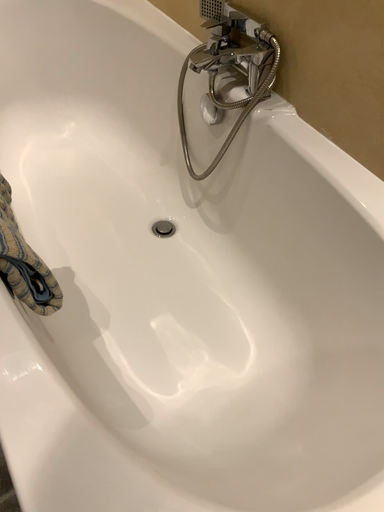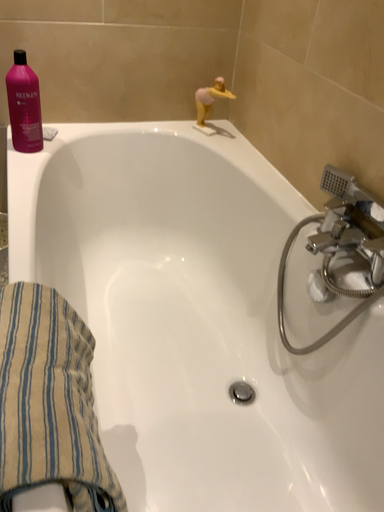
Question: How did the camera likely rotate when shooting the video?

Choices:
 (A) rotated right
 (B) rotated left

Answer: (B)